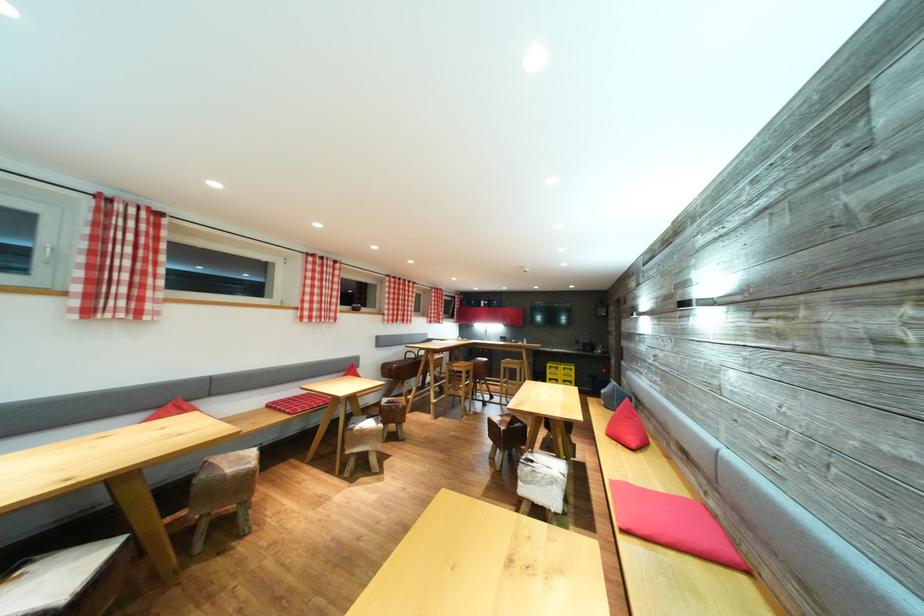
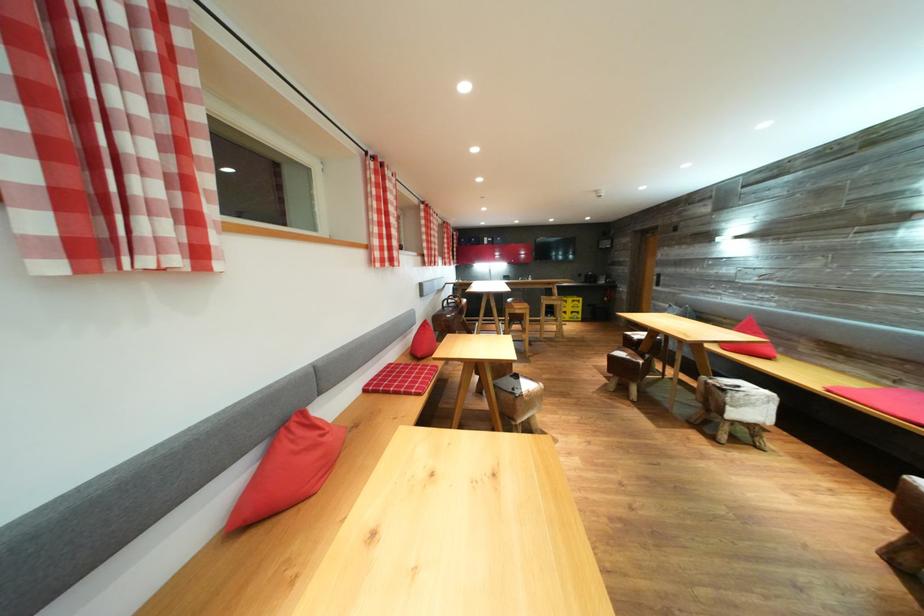
Where in the second image is the point corresponding to point (116, 321) from the first image?

(153, 267)